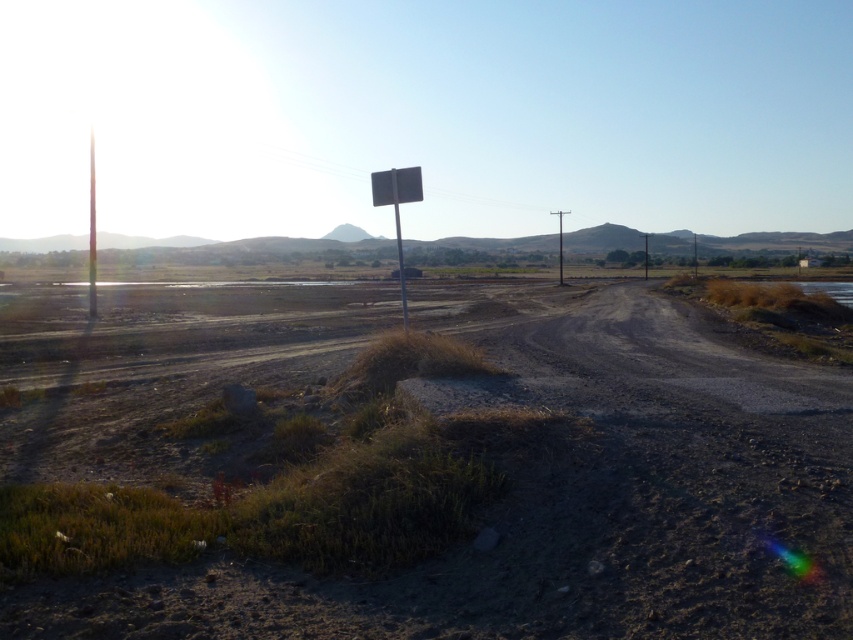
You are a hiker navigating a rural path and see two metallic signposts. The first is the metallic signpost at left, and the second is the metallic signpost at center. Which signpost is positioned higher up in the image?

The metallic signpost at left is located above the metallic signpost at center, so it is positioned higher up in the image.

You are standing at the point labeled as point (434, 481). What is the surface you are currently standing on?

The surface at point (434, 481) is dull brown dirt at center.